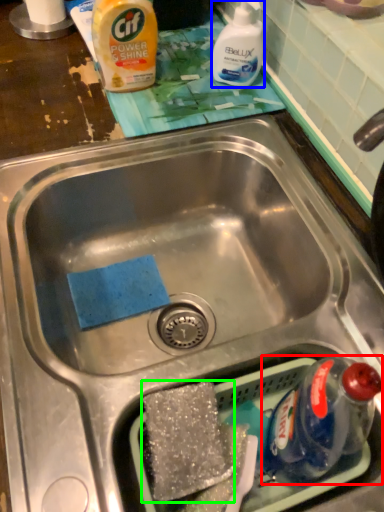
Question: Which is farther away from bottle (highlighted by a red box)? cleaning product (highlighted by a blue box) or food (highlighted by a green box)?

Choices:
 (A) cleaning product
 (B) food

Answer: (A)